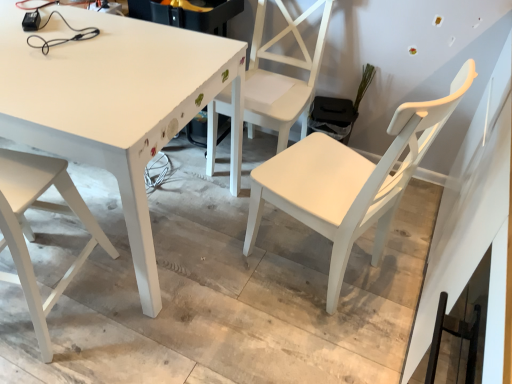
Identify the location of free space to the back side of white matte chair at lower left, placed as the third chair when sorted from right to left. (101, 212).